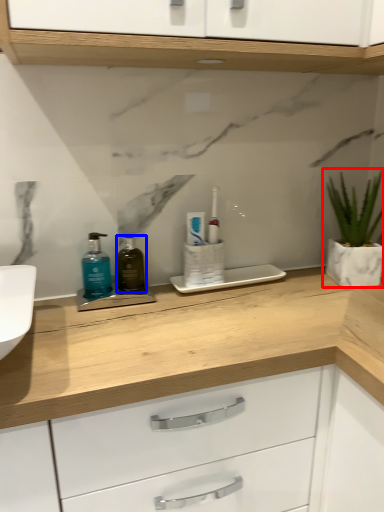
Question: Which point is closer to the camera, houseplant (highlighted by a red box) or mouthwash (highlighted by a blue box)?

Choices:
 (A) houseplant
 (B) mouthwash

Answer: (B)